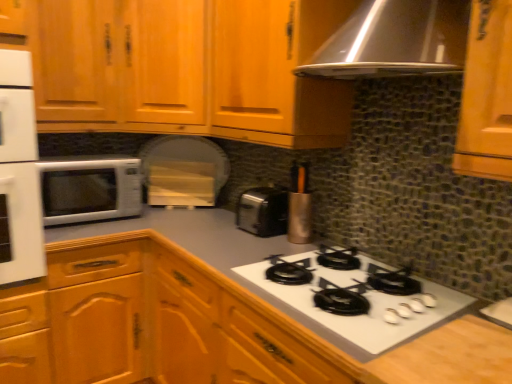
Question: From the image's perspective, is white glossy microwave at left under white glossy gas stove at center?

Choices:
 (A) yes
 (B) no

Answer: (B)

Question: Can you confirm if white glossy microwave at left is smaller than white glossy gas stove at center?

Choices:
 (A) yes
 (B) no

Answer: (B)

Question: Would you say white glossy microwave at left is outside white glossy gas stove at center?

Choices:
 (A) no
 (B) yes

Answer: (B)

Question: From a real-world perspective, is white glossy microwave at left below white glossy gas stove at center?

Choices:
 (A) yes
 (B) no

Answer: (B)

Question: Can you confirm if white glossy microwave at left is thinner than white glossy gas stove at center?

Choices:
 (A) no
 (B) yes

Answer: (B)

Question: Is white glossy microwave at left beside white glossy gas stove at center?

Choices:
 (A) yes
 (B) no

Answer: (B)

Question: Does white glossy gas stove at center have a larger size compared to white glossy microwave at left?

Choices:
 (A) yes
 (B) no

Answer: (B)

Question: From the image's perspective, is white glossy gas stove at center on top of white glossy microwave at left?

Choices:
 (A) no
 (B) yes

Answer: (A)

Question: Can you confirm if white glossy gas stove at center is smaller than white glossy microwave at left?

Choices:
 (A) yes
 (B) no

Answer: (A)

Question: Is white glossy gas stove at center wider than white glossy microwave at left?

Choices:
 (A) yes
 (B) no

Answer: (A)

Question: From a real-world perspective, is white glossy gas stove at center positioned over white glossy microwave at left based on gravity?

Choices:
 (A) no
 (B) yes

Answer: (A)

Question: Can you confirm if white glossy gas stove at center is taller than white glossy microwave at left?

Choices:
 (A) no
 (B) yes

Answer: (A)

Question: Considering the relative sizes of white glossy sink at lower right and wooden cabinet at upper left, which is counted as the first cabinetry, starting from the top, in the image provided, is white glossy sink at lower right wider than wooden cabinet at upper left, which is counted as the first cabinetry, starting from the top,?

Choices:
 (A) yes
 (B) no

Answer: (B)